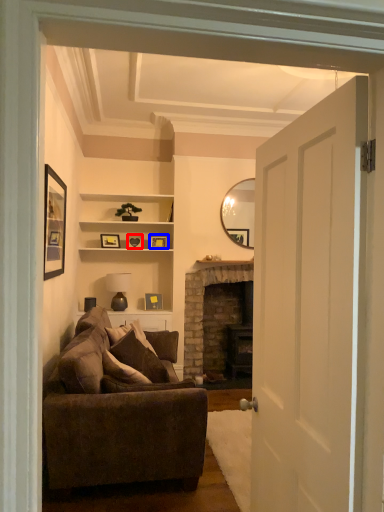
Question: Which object is further to the camera taking this photo, picture frame (highlighted by a red box) or picture frame (highlighted by a blue box)?

Choices:
 (A) picture frame
 (B) picture frame

Answer: (B)